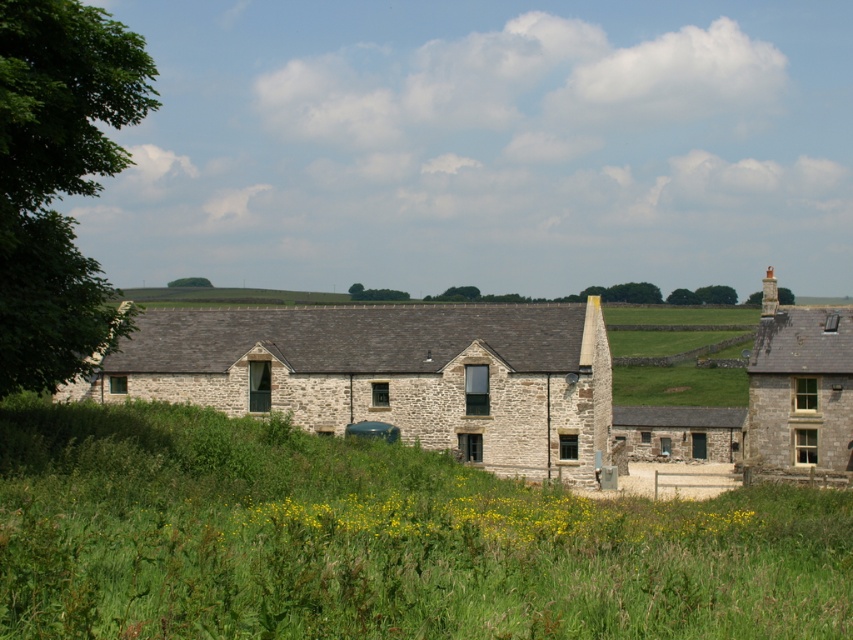
You are a photographer planning to capture the stone chimney at upper right and the green grassy field at center in a single shot. Which object will occupy more horizontal space in the photo?

The green grassy field at center will occupy more horizontal space in the photo since its width surpasses that of the stone chimney at upper right.

You are standing in the countryside and see the green grassy field at center and the stone cottage at center. Which one is taller?

The green grassy field at center has a lesser height compared to stone cottage at center, so the stone cottage at center is taller.